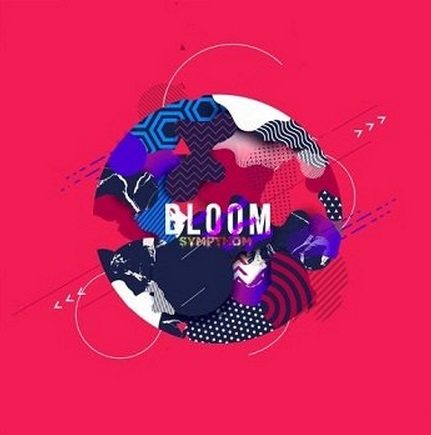
The height and width of the screenshot is (435, 431). What are the coordinates of `white paint splotch area` in the screenshot? It's located at (247, 112).